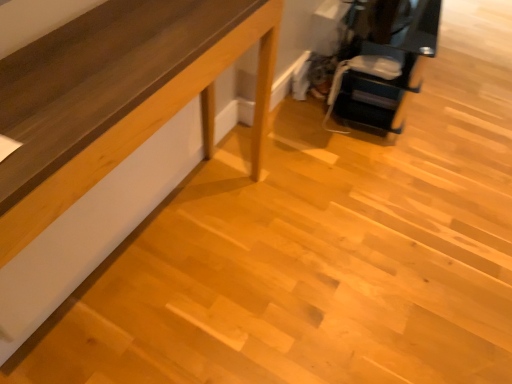
How much space does light brown wood table at lower left, the first furniture when ordered from left to right, occupy vertically?

It is 17.06 centimeters.

Locate an element on the screen. This screenshot has height=384, width=512. light brown wood table at lower left, marked as the 2th furniture in a right-to-left arrangement is located at coordinates (152, 129).

What do you see at coordinates (152, 129) in the screenshot? I see `light brown wood table at lower left, the first furniture when ordered from left to right` at bounding box center [152, 129].

Based on the photo, in order to face matte black printer at upper right, marked as the 2th furniture in a bottom-to-top arrangement, should I rotate leftwards or rightwards?

You should look right and rotate roughly 16.938 degrees.

What do you see at coordinates (384, 61) in the screenshot?
I see `matte black printer at upper right, marked as the 2th furniture in a bottom-to-top arrangement` at bounding box center [384, 61].

I want to click on matte black printer at upper right, marked as the 2th furniture in a bottom-to-top arrangement, so click(384, 61).

At what (x,y) coordinates should I click in order to perform the action: click on light brown wood table at lower left, the first furniture when ordered from left to right. Please return your answer as a coordinate pair (x, y). This screenshot has width=512, height=384. Looking at the image, I should click on (x=152, y=129).

Considering the positions of objects light brown wood table at lower left, marked as the 2th furniture in a right-to-left arrangement, and matte black printer at upper right, positioned as the first furniture in top-to-bottom order, in the image provided, who is more to the left, light brown wood table at lower left, marked as the 2th furniture in a right-to-left arrangement, or matte black printer at upper right, positioned as the first furniture in top-to-bottom order,?

light brown wood table at lower left, marked as the 2th furniture in a right-to-left arrangement, is more to the left.

Based on the photo, which object is closer to the camera, light brown wood table at lower left, which is the second furniture in top-to-bottom order, or matte black printer at upper right, the 2th furniture from the left?

light brown wood table at lower left, which is the second furniture in top-to-bottom order, is more forward.

Does point (254, 115) come behind point (396, 128)?

No, it is in front of (396, 128).

From the image's perspective, is light brown wood table at lower left, which is the second furniture in top-to-bottom order, located beneath matte black printer at upper right, the 2th furniture from the left?

Yes, from the image's perspective, light brown wood table at lower left, which is the second furniture in top-to-bottom order, is below matte black printer at upper right, the 2th furniture from the left.

From a real-world perspective, which is physically above, light brown wood table at lower left, marked as the 2th furniture in a right-to-left arrangement, or matte black printer at upper right, placed as the 1th furniture when sorted from right to left?

matte black printer at upper right, placed as the 1th furniture when sorted from right to left, is physically above.

Considering the relative sizes of light brown wood table at lower left, the first furniture when ordered from left to right, and matte black printer at upper right, positioned as the first furniture in top-to-bottom order, in the image provided, is light brown wood table at lower left, the first furniture when ordered from left to right, thinner than matte black printer at upper right, positioned as the first furniture in top-to-bottom order,?

Yes.

Between light brown wood table at lower left, marked as the 2th furniture in a right-to-left arrangement, and matte black printer at upper right, marked as the 2th furniture in a bottom-to-top arrangement, which one has less height?

light brown wood table at lower left, marked as the 2th furniture in a right-to-left arrangement, is shorter.

Who is bigger, light brown wood table at lower left, which is the second furniture in top-to-bottom order, or matte black printer at upper right, placed as the 1th furniture when sorted from right to left?

With larger size is matte black printer at upper right, placed as the 1th furniture when sorted from right to left.

Would you say light brown wood table at lower left, the first furniture when ordered from left to right, is inside or outside matte black printer at upper right, marked as the 2th furniture in a bottom-to-top arrangement?

light brown wood table at lower left, the first furniture when ordered from left to right, is located beyond the bounds of matte black printer at upper right, marked as the 2th furniture in a bottom-to-top arrangement.

Is there a large distance between light brown wood table at lower left, which is the second furniture in top-to-bottom order, and matte black printer at upper right, positioned as the first furniture in top-to-bottom order?

Yes, light brown wood table at lower left, which is the second furniture in top-to-bottom order, is far from matte black printer at upper right, positioned as the first furniture in top-to-bottom order.

In the scene shown: Is light brown wood table at lower left, acting as the 1th furniture starting from the bottom, facing away from matte black printer at upper right, positioned as the first furniture in top-to-bottom order?

No, matte black printer at upper right, positioned as the first furniture in top-to-bottom order, is not at the back of light brown wood table at lower left, acting as the 1th furniture starting from the bottom.

In the scene shown: How much distance is there between light brown wood table at lower left, acting as the 1th furniture starting from the bottom, and matte black printer at upper right, positioned as the first furniture in top-to-bottom order?

light brown wood table at lower left, acting as the 1th furniture starting from the bottom, and matte black printer at upper right, positioned as the first furniture in top-to-bottom order, are 3.39 feet apart.

Find the location of `furniture behind the light brown wood table at lower left, the first furniture when ordered from left to right`. furniture behind the light brown wood table at lower left, the first furniture when ordered from left to right is located at coordinates pyautogui.click(x=384, y=61).

Considering the relative positions of matte black printer at upper right, positioned as the first furniture in top-to-bottom order, and light brown wood table at lower left, the first furniture when ordered from left to right, in the image provided, is matte black printer at upper right, positioned as the first furniture in top-to-bottom order, to the left or to the right of light brown wood table at lower left, the first furniture when ordered from left to right,?

From the image, it's evident that matte black printer at upper right, positioned as the first furniture in top-to-bottom order, is to the right of light brown wood table at lower left, the first furniture when ordered from left to right.

Relative to light brown wood table at lower left, which is the second furniture in top-to-bottom order, is matte black printer at upper right, the 2th furniture from the left, in front or behind?

Clearly, matte black printer at upper right, the 2th furniture from the left, is behind light brown wood table at lower left, which is the second furniture in top-to-bottom order.

Which is in front, point (327, 117) or point (185, 98)?

The point (185, 98) is in front.

Based on the photo, from the image's perspective, which is below, matte black printer at upper right, the 2th furniture from the left, or light brown wood table at lower left, which is the second furniture in top-to-bottom order?

light brown wood table at lower left, which is the second furniture in top-to-bottom order.

From a real-world perspective, between matte black printer at upper right, marked as the 2th furniture in a bottom-to-top arrangement, and light brown wood table at lower left, which is the second furniture in top-to-bottom order, who is vertically lower?

light brown wood table at lower left, which is the second furniture in top-to-bottom order.

Can you confirm if matte black printer at upper right, positioned as the first furniture in top-to-bottom order, is wider than light brown wood table at lower left, the first furniture when ordered from left to right?

Yes.

From their relative heights in the image, would you say matte black printer at upper right, positioned as the first furniture in top-to-bottom order, is taller or shorter than light brown wood table at lower left, acting as the 1th furniture starting from the bottom?

Clearly, matte black printer at upper right, positioned as the first furniture in top-to-bottom order, is taller compared to light brown wood table at lower left, acting as the 1th furniture starting from the bottom.

Is matte black printer at upper right, positioned as the first furniture in top-to-bottom order, smaller than light brown wood table at lower left, which is the second furniture in top-to-bottom order?

No.

Is matte black printer at upper right, marked as the 2th furniture in a bottom-to-top arrangement, located outside light brown wood table at lower left, which is the second furniture in top-to-bottom order?

Yes, matte black printer at upper right, marked as the 2th furniture in a bottom-to-top arrangement, is outside of light brown wood table at lower left, which is the second furniture in top-to-bottom order.

Would you consider matte black printer at upper right, marked as the 2th furniture in a bottom-to-top arrangement, to be distant from light brown wood table at lower left, marked as the 2th furniture in a right-to-left arrangement?

Yes.

Does matte black printer at upper right, the 2th furniture from the left, turn towards light brown wood table at lower left, marked as the 2th furniture in a right-to-left arrangement?

No, matte black printer at upper right, the 2th furniture from the left, is not oriented towards light brown wood table at lower left, marked as the 2th furniture in a right-to-left arrangement.

Find the location of `furniture above the light brown wood table at lower left, acting as the 1th furniture starting from the bottom (from the image's perspective)`. furniture above the light brown wood table at lower left, acting as the 1th furniture starting from the bottom (from the image's perspective) is located at coordinates (384, 61).

Find the location of `furniture that is on the left side of matte black printer at upper right, the 2th furniture from the left`. furniture that is on the left side of matte black printer at upper right, the 2th furniture from the left is located at coordinates (152, 129).

In order to click on furniture in front of the matte black printer at upper right, the 2th furniture from the left in this screenshot , I will do `click(152, 129)`.